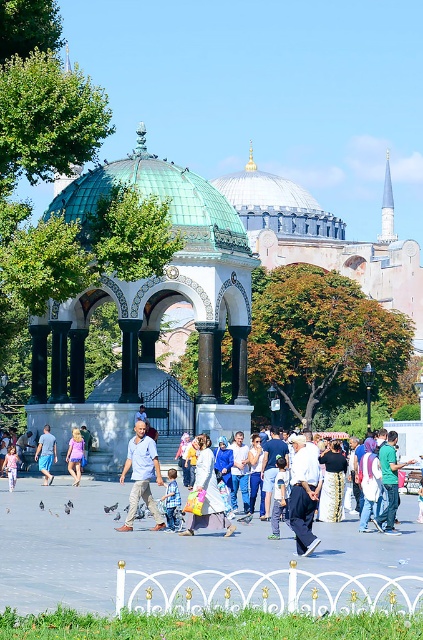
Who is positioned more to the left, white cotton dress at center or green fabric shirt at center?

white cotton dress at center

Is white cotton dress at center below green fabric shirt at center?

No, white cotton dress at center is not below green fabric shirt at center.

Is point (198, 449) positioned before point (389, 429)?

Yes, it is in front of point (389, 429).

Where is `white cotton dress at center`? This screenshot has height=640, width=423. white cotton dress at center is located at coordinates (206, 493).

Between green mosaic gazebo at center and white cotton shirt at center, which one appears on the right side from the viewer's perspective?

white cotton shirt at center is more to the right.

Between green mosaic gazebo at center and white cotton shirt at center, which one has more height?

green mosaic gazebo at center is taller.

Does point (139, 298) come closer to viewer compared to point (308, 525)?

No, (139, 298) is behind (308, 525).

Locate an element on the screen. The height and width of the screenshot is (640, 423). green mosaic gazebo at center is located at coordinates (151, 314).

Does point (233, 241) come in front of point (307, 528)?

No, it is not.

In the scene shown: Is the position of green copper dome at center less distant than that of white cotton shirt at center?

No.

Is point (244, 241) in front of point (301, 536)?

No, (244, 241) is further to viewer.

The width and height of the screenshot is (423, 640). I want to click on green copper dome at center, so click(159, 198).